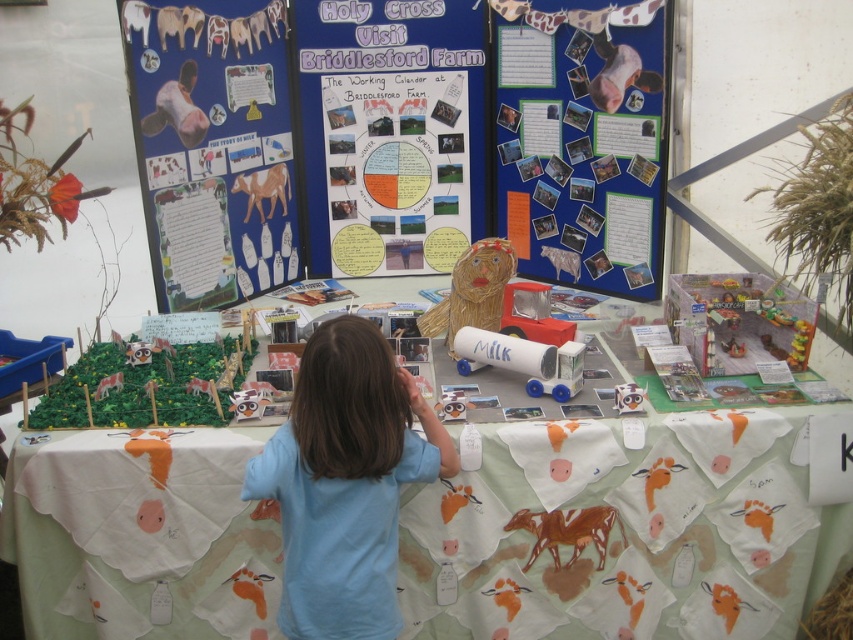
Is blue paperboard poster at upper center below white paper with cow prints at center?

No, blue paperboard poster at upper center is not below white paper with cow prints at center.

Can you confirm if blue paperboard poster at upper center is positioned above white paper with cow prints at center?

Correct, blue paperboard poster at upper center is located above white paper with cow prints at center.

Which is in front, point (370, 116) or point (805, 602)?

Point (805, 602)

At what (x,y) coordinates should I click in order to perform the action: click on blue paperboard poster at upper center. Please return your answer as a coordinate pair (x, y). The image size is (853, 640). Looking at the image, I should click on (438, 125).

Is point (566, 60) positioned before point (279, 252)?

Yes.

At what (x,y) coordinates should I click in order to perform the action: click on blue paperboard at upper right. Please return your answer as a coordinate pair (x, y). The height and width of the screenshot is (640, 853). Looking at the image, I should click on (582, 140).

Where is `blue paperboard at upper right`? blue paperboard at upper right is located at coordinates (582, 140).

How distant is light blue shirt at center from woven straw lion at center?

light blue shirt at center is 23.68 inches from woven straw lion at center.

Can you confirm if light blue shirt at center is bigger than woven straw lion at center?

Correct, light blue shirt at center is larger in size than woven straw lion at center.

Is point (323, 536) in front of point (514, 266)?

Yes, it is in front of point (514, 266).

You are a GUI agent. You are given a task and a screenshot of the screen. Output one action in this format:
    pyautogui.click(x=<x>, y=<y>)
    Task: Click on the light blue shirt at center
    
    Given the screenshot: What is the action you would take?
    pyautogui.click(x=345, y=481)